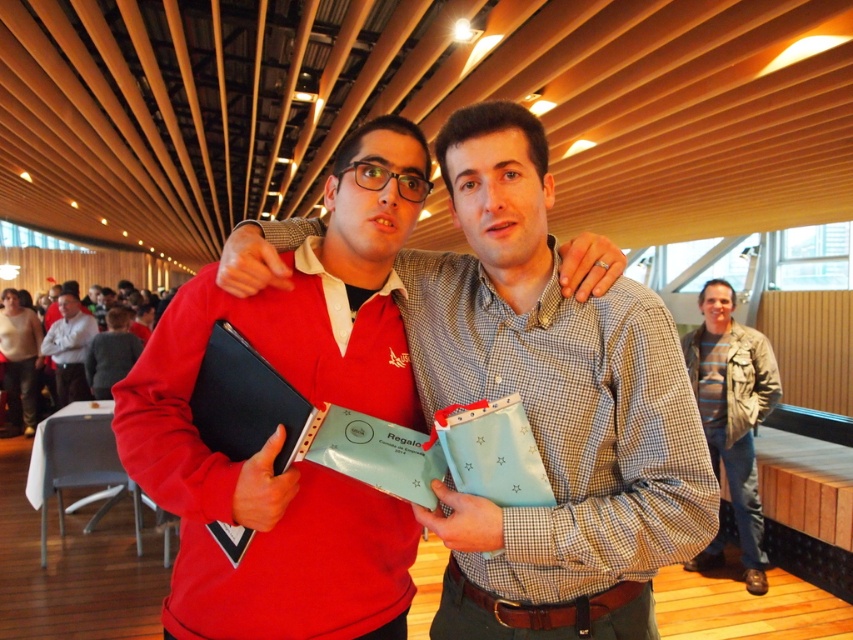
Does striped cotton shirt at right have a greater height compared to light gray shirt at center?

Yes, striped cotton shirt at right is taller than light gray shirt at center.

Between point (693, 563) and point (73, 368), which one is positioned behind?

The point (73, 368) is behind.

Identify the location of striped cotton shirt at right. (733, 410).

Describe the element at coordinates (19, 362) in the screenshot. I see `jeans at left` at that location.

Measure the distance between point [28,346] and camera.

Point [28,346] is 24.61 feet away from camera.

Does point (21, 321) come in front of point (57, 356)?

That is False.

I want to click on jeans at left, so 19,362.

Does matte black laptop at center appear on the right side of jeans at left?

Correct, you'll find matte black laptop at center to the right of jeans at left.

Based on the photo, between matte black laptop at center and jeans at left, which one has less height?

Standing shorter between the two is matte black laptop at center.

Describe the element at coordinates (550, 406) in the screenshot. This screenshot has height=640, width=853. I see `matte black laptop at center` at that location.

Find the location of a particular element. This screenshot has height=640, width=853. matte black laptop at center is located at coordinates tap(550, 406).